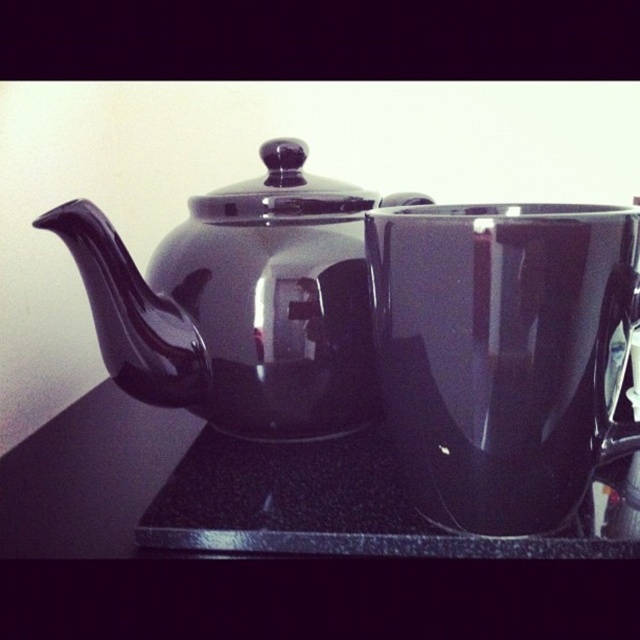
Does glossy ceramic teapot at center have a smaller size compared to glossy black countertop at center?

No.

Does glossy ceramic teapot at center have a greater width compared to glossy black countertop at center?

No.

Between point (349, 385) and point (0, 476), which one is positioned behind?

Point (0, 476)

Where is `glossy ceramic teapot at center`? The image size is (640, 640). glossy ceramic teapot at center is located at coordinates (241, 301).

Is glossy ceramic mug at upper center further to camera compared to glossy ceramic teapot at center?

No, it is not.

Is glossy ceramic mug at upper center shorter than glossy ceramic teapot at center?

Correct, glossy ceramic mug at upper center is not as tall as glossy ceramic teapot at center.

Locate an element on the screen. Image resolution: width=640 pixels, height=640 pixels. glossy ceramic mug at upper center is located at coordinates (502, 355).

Does glossy ceramic mug at upper center have a lesser height compared to glossy black countertop at center?

No, glossy ceramic mug at upper center is not shorter than glossy black countertop at center.

Does glossy ceramic mug at upper center have a greater width compared to glossy black countertop at center?

Incorrect, glossy ceramic mug at upper center's width does not surpass glossy black countertop at center's.

What do you see at coordinates (502, 355) in the screenshot? The image size is (640, 640). I see `glossy ceramic mug at upper center` at bounding box center [502, 355].

In order to click on glossy ceramic mug at upper center in this screenshot , I will do `click(502, 355)`.